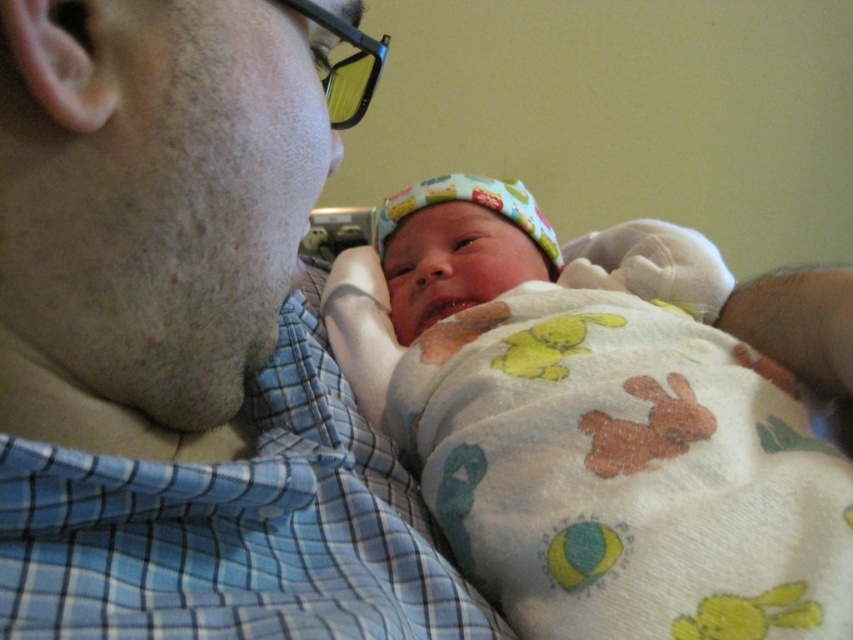
Question: Which point appears closest to the camera in this image?

Choices:
 (A) (697, 572)
 (B) (244, 211)

Answer: (B)

Question: Which object appears farthest from the camera in this image?

Choices:
 (A) blue plaid shirt at upper left
 (B) soft cotton blanket at center

Answer: (B)

Question: Considering the relative positions of blue plaid shirt at upper left and soft cotton blanket at center in the image provided, where is blue plaid shirt at upper left located with respect to soft cotton blanket at center?

Choices:
 (A) below
 (B) above

Answer: (A)

Question: Is blue plaid shirt at upper left positioned in front of soft cotton blanket at center?

Choices:
 (A) yes
 (B) no

Answer: (A)

Question: Which point is closer to the camera taking this photo?

Choices:
 (A) (604, 451)
 (B) (57, 556)

Answer: (B)

Question: Observing the image, what is the correct spatial positioning of blue plaid shirt at upper left in reference to soft cotton blanket at center?

Choices:
 (A) right
 (B) left

Answer: (B)